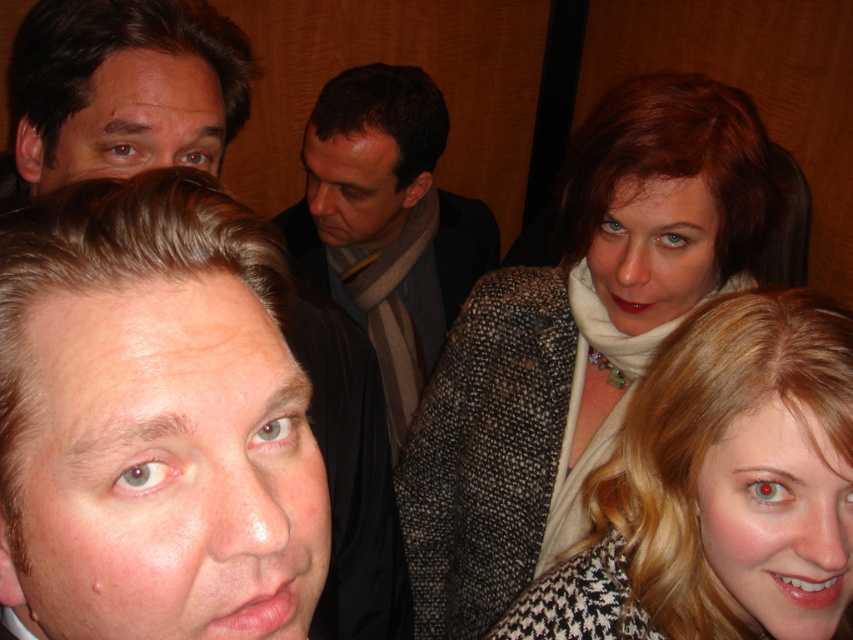
Question: Can you confirm if blonde hair at upper right is bigger than dark gray scarf at center?

Choices:
 (A) no
 (B) yes

Answer: (A)

Question: Which of these objects is positioned farthest from the dark gray scarf at center?

Choices:
 (A) smooth skin face at upper left
 (B) blonde hair at upper right
 (C) speckled wool coat at upper right

Answer: (B)

Question: Which of the following is the farthest from the observer?

Choices:
 (A) smooth skin face at upper left
 (B) blonde hair at upper right
 (C) speckled wool coat at upper right

Answer: (C)

Question: Which of the following is the closest to the observer?

Choices:
 (A) (103, 88)
 (B) (711, 538)
 (C) (583, 221)
 (D) (369, 292)

Answer: (B)

Question: Can you confirm if speckled wool coat at upper right is positioned to the left of dark gray scarf at center?

Choices:
 (A) no
 (B) yes

Answer: (A)

Question: Can you confirm if blonde hair at upper right is bigger than smooth skin face at upper left?

Choices:
 (A) no
 (B) yes

Answer: (B)